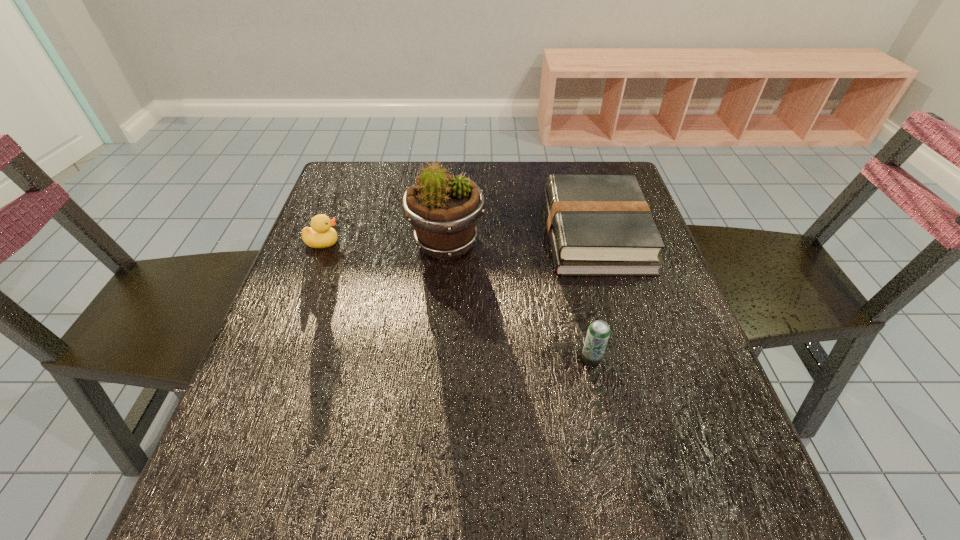
At what (x,y) coordinates should I click in order to perform the action: click on flowerpot. Please return your answer as a coordinate pair (x, y). This screenshot has height=540, width=960. Looking at the image, I should click on (443, 209).

Locate an element on the screen. The width and height of the screenshot is (960, 540). the third object from right to left is located at coordinates (443, 209).

Locate an element on the screen. This screenshot has height=540, width=960. beer can is located at coordinates (598, 333).

At what (x,y) coordinates should I click in order to perform the action: click on hardback book. Please return your answer as a coordinate pair (x, y). Looking at the image, I should click on (599, 225).

Identify the location of duckling. Image resolution: width=960 pixels, height=540 pixels. (320, 235).

Find the location of a particular element. free space located 0.090m on the right of the third object from right to left is located at coordinates (520, 243).

This screenshot has width=960, height=540. Find the location of `vacant region located 0.260m on the left of the beer can`. vacant region located 0.260m on the left of the beer can is located at coordinates click(x=447, y=358).

Image resolution: width=960 pixels, height=540 pixels. I want to click on vacant region located 0.330m on the spine side of the hardback book, so click(418, 234).

I want to click on free region located 0.320m on the spine side of the hardback book, so click(421, 234).

Locate an element on the screen. The image size is (960, 540). vacant area situated 0.250m on the spine side of the hardback book is located at coordinates (448, 234).